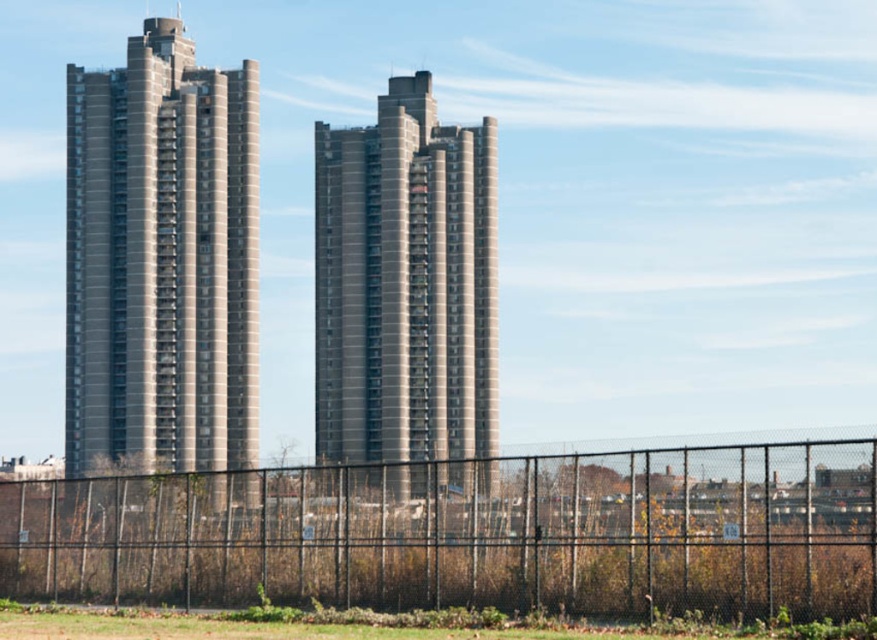
Question: Considering the real-world distances, which object is closest to the black metal fence at lower center?

Choices:
 (A) gray concrete building at left
 (B) gray concrete building at center

Answer: (B)

Question: Is gray concrete building at left thinner than gray concrete building at center?

Choices:
 (A) no
 (B) yes

Answer: (A)

Question: Which point appears farthest from the camera in this image?

Choices:
 (A) (0, 593)
 (B) (391, 449)

Answer: (B)

Question: Is gray concrete building at left thinner than gray concrete building at center?

Choices:
 (A) yes
 (B) no

Answer: (B)

Question: Which of the following is the farthest from the observer?

Choices:
 (A) gray concrete building at center
 (B) black metal fence at lower center
 (C) gray concrete building at left

Answer: (C)

Question: Where is black metal fence at lower center located in relation to gray concrete building at left in the image?

Choices:
 (A) left
 (B) right

Answer: (B)